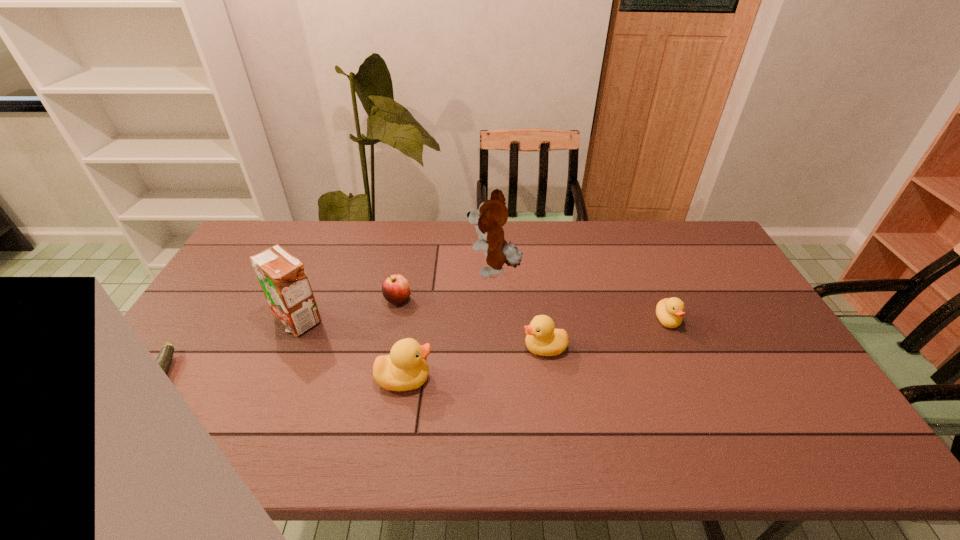
This screenshot has width=960, height=540. In the image, there is a desktop. Identify the location of blank space at the left edge. (188, 341).

In the image, there is a desktop. Where is `vacant area at the far left corner`? vacant area at the far left corner is located at coordinates (252, 237).

At what (x,y) coordinates should I click in order to perform the action: click on vacant area that lies between the leftmost object and the puppy. Please return your answer as a coordinate pair (x, y). The width and height of the screenshot is (960, 540). Looking at the image, I should click on (328, 323).

The image size is (960, 540). I want to click on empty space that is in between the shortest object and the tallest object, so click(328, 323).

Locate an element on the screen. unoccupied position between the apple and the tallest object is located at coordinates tap(446, 285).

The image size is (960, 540). In order to click on vacant area that lies between the apple and the rightmost duckling in this screenshot , I will do `click(533, 309)`.

Identify the location of free space between the apple and the shortest duckling. (533, 309).

Identify the location of free point between the carton and the apple. This screenshot has width=960, height=540. (348, 309).

Find the location of `free spot between the tallest duckling and the second nearest duckling`. free spot between the tallest duckling and the second nearest duckling is located at coordinates (474, 363).

I want to click on free space between the leftmost object and the carton, so click(229, 348).